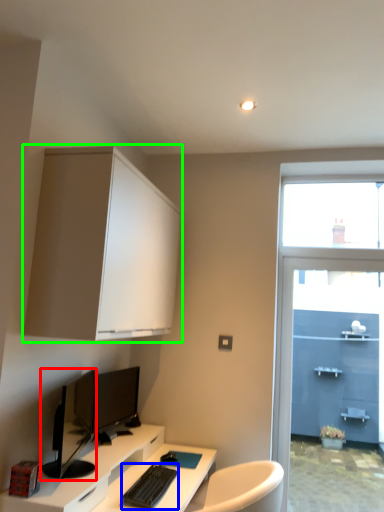
Question: Which is farther away from computer monitor (highlighted by a red box)? computer keyboard (highlighted by a blue box) or cabinetry (highlighted by a green box)?

Choices:
 (A) computer keyboard
 (B) cabinetry

Answer: (B)